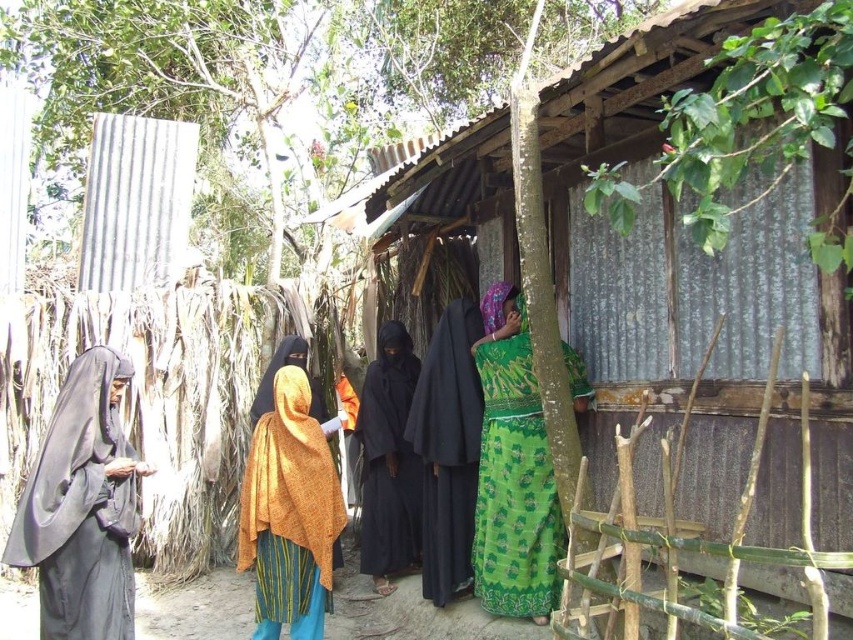
Question: Which point appears closest to the camera in this image?

Choices:
 (A) (276, 490)
 (B) (55, 513)
 (C) (430, 412)
 (D) (514, 529)

Answer: (B)

Question: Can you confirm if black matte robe at left is positioned above black matte robe at center?

Choices:
 (A) no
 (B) yes

Answer: (A)

Question: Which object is the closest to the black matte robe at left?

Choices:
 (A) orange textured shawl at center
 (B) green printed dress at right
 (C) black matte dress at center
 (D) black matte robe at center

Answer: (A)

Question: Where is orange textured shawl at center located in relation to black matte dress at center in the image?

Choices:
 (A) below
 (B) above

Answer: (A)

Question: Does green printed dress at right appear over orange textured shawl at center?

Choices:
 (A) yes
 (B) no

Answer: (A)

Question: Among these points, which one is nearest to the camera?

Choices:
 (A) (440, 445)
 (B) (390, 497)
 (C) (500, 493)

Answer: (C)